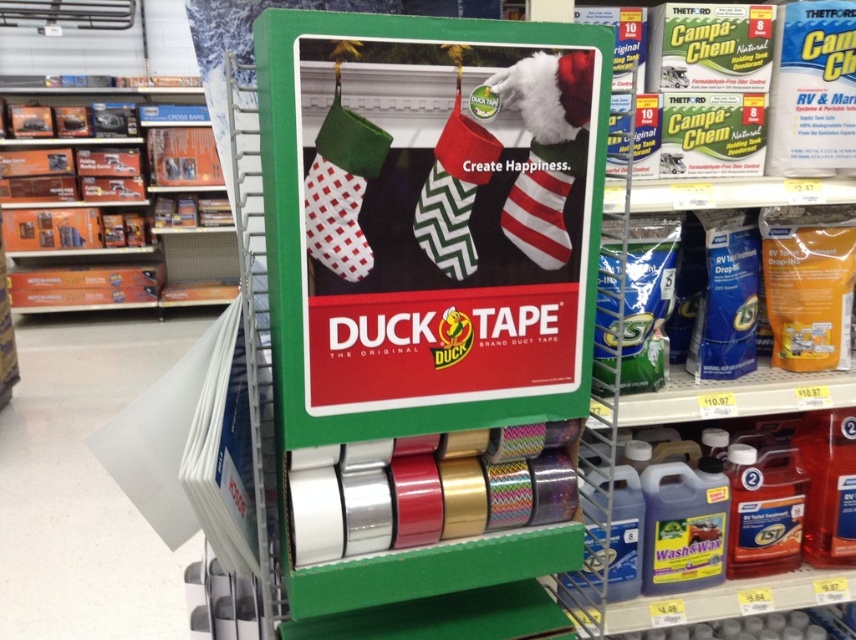
Question: Is green matte cardboard at center positioned at the back of translucent plastic bottle at lower right?

Choices:
 (A) yes
 (B) no

Answer: (B)

Question: Among these objects, which one is farthest from the camera?

Choices:
 (A) orange cardboard boxes at left
 (B) white checkered fabric stocking at center
 (C) green matte cardboard at center

Answer: (A)

Question: Which object is farther from the camera taking this photo?

Choices:
 (A) translucent plastic bottle at lower right
 (B) red and white striped sock at center
 (C) orange cardboard boxes at left
 (D) green matte cardboard at center

Answer: (C)

Question: From the image, what is the correct spatial relationship of white checkered fabric stocking at center in relation to green zigzag fabric sock at center?

Choices:
 (A) below
 (B) above

Answer: (A)

Question: Does orange cardboard boxes at left appear on the left side of white checkered fabric stocking at center?

Choices:
 (A) yes
 (B) no

Answer: (A)

Question: Which point appears closest to the camera in this image?

Choices:
 (A) (325, 196)
 (B) (201, 240)
 (C) (532, 177)
 (D) (287, 323)

Answer: (A)